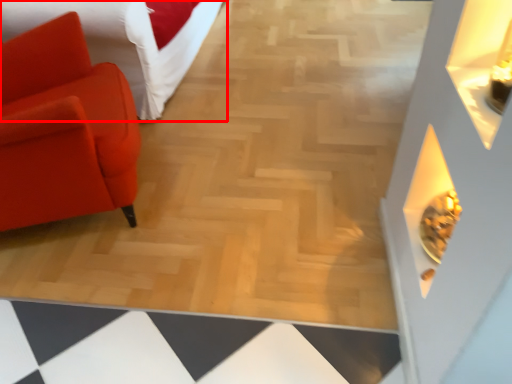
Question: From the image's perspective, where is furniture (annotated by the red box) located in relation to chair in the image?

Choices:
 (A) below
 (B) above

Answer: (B)